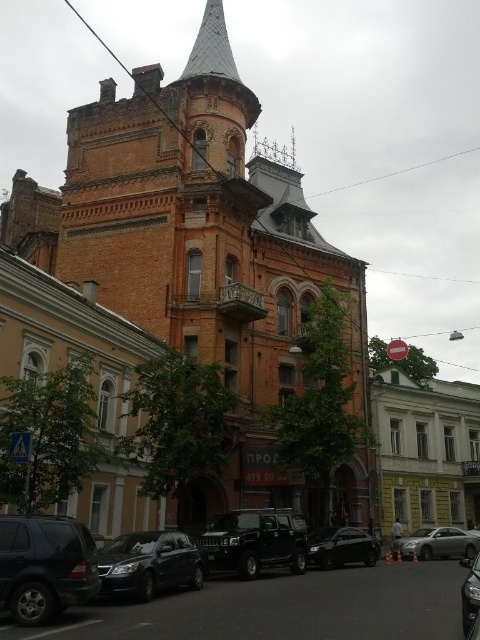
Question: Which object is closer to the camera taking this photo?

Choices:
 (A) black matte suv at center
 (B) matte black suv at lower left

Answer: (B)

Question: Does black matte suv at center appear over shiny black sedan at lower left?

Choices:
 (A) yes
 (B) no

Answer: (B)

Question: Which point is closer to the camera?

Choices:
 (A) black matte suv at center
 (B) black glossy car at center

Answer: (A)

Question: Which point is farther to the camera?

Choices:
 (A) (242, 512)
 (B) (61, 563)
 (C) (313, 552)
 (D) (466, 602)

Answer: (C)

Question: Does matte black suv at lower left have a lesser width compared to black glossy car at center?

Choices:
 (A) no
 (B) yes

Answer: (B)

Question: From the image, what is the correct spatial relationship of black glossy car at center in relation to silver metallic sedan at lower right?

Choices:
 (A) above
 (B) below

Answer: (A)